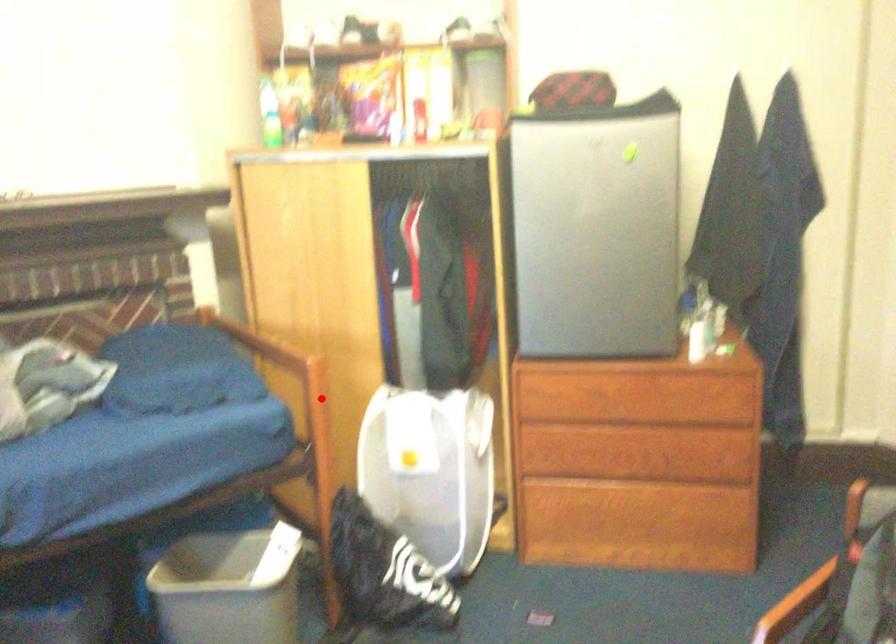
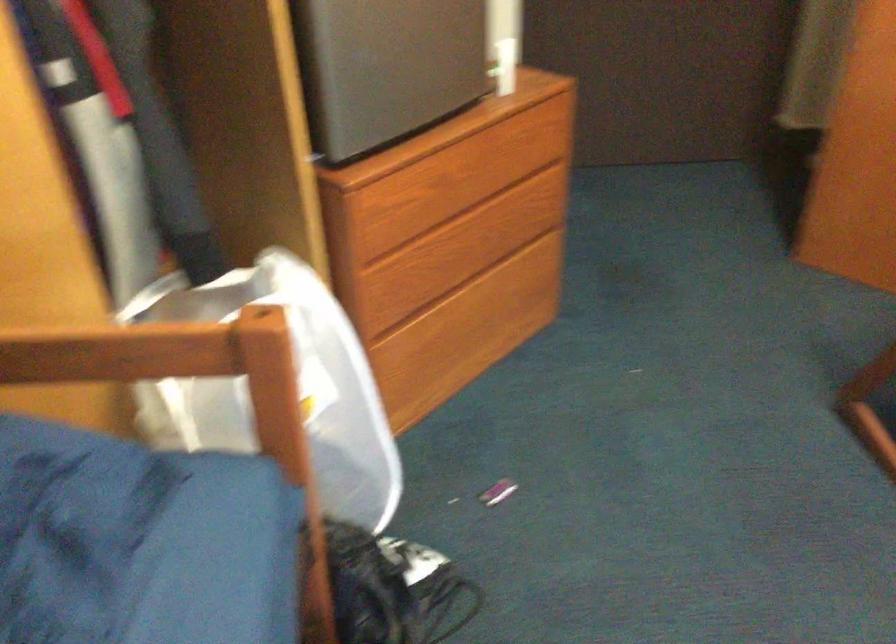
Question: I am providing you with two images of the same scene from different viewpoints. A red point is marked on the first image. Is the red point's position out of view in image 2?

Choices:
 (A) Yes
 (B) No

Answer: (B)